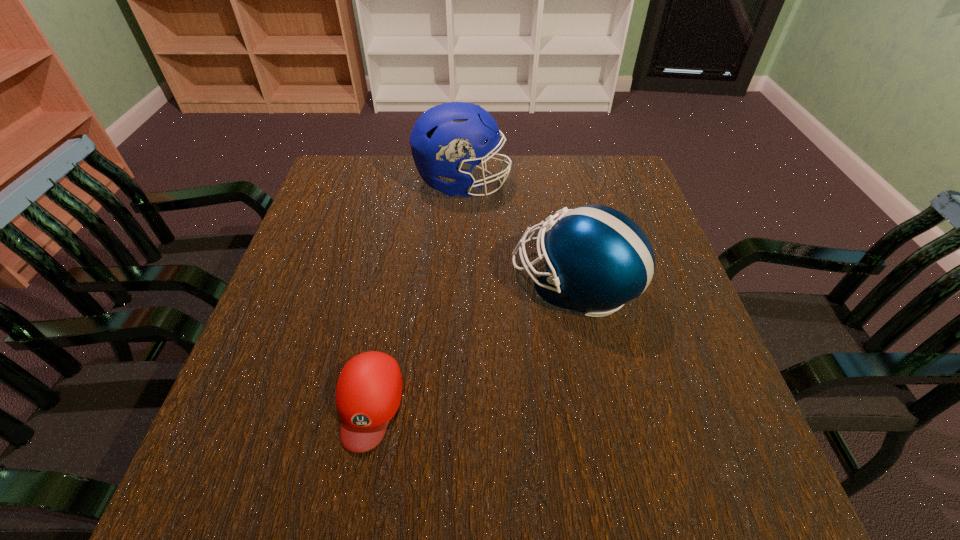
You are a GUI agent. You are given a task and a screenshot of the screen. Output one action in this format:
    pyautogui.click(x=<x>, y=<y>)
    Task: Click on the vacant area that lies between the second farthest object and the farthest object
    
    Given the screenshot: What is the action you would take?
    pyautogui.click(x=518, y=235)

At what (x,y) coordinates should I click in order to perform the action: click on vacant region between the nearest object and the second farthest object. Please return your answer as a coordinate pair (x, y). This screenshot has height=540, width=960. Looking at the image, I should click on (471, 344).

At what (x,y) coordinates should I click in order to perform the action: click on free spot between the baseball cap and the farther football helmet. Please return your answer as a coordinate pair (x, y). Looking at the image, I should click on 416,294.

This screenshot has height=540, width=960. Identify the location of vacant space in between the farthest object and the baseball cap. (416, 294).

You are a GUI agent. You are given a task and a screenshot of the screen. Output one action in this format:
    pyautogui.click(x=<x>, y=<y>)
    Task: Click on the free space between the nearer football helmet and the farther football helmet
    Image resolution: width=960 pixels, height=540 pixels.
    Given the screenshot: What is the action you would take?
    pyautogui.click(x=518, y=235)

Where is `object that stands as the closest to the nearer football helmet`? object that stands as the closest to the nearer football helmet is located at coordinates pyautogui.click(x=445, y=141).

This screenshot has height=540, width=960. In order to click on object that is the second closest one to the shortest object in this screenshot , I will do `click(445, 141)`.

You are a GUI agent. You are given a task and a screenshot of the screen. Output one action in this format:
    pyautogui.click(x=<x>, y=<y>)
    Task: Click on the free region that satisfies the following two spatial constraints: 1. on the front-facing side of the farther football helmet; 2. on the front-facing side of the shortest object
    The width and height of the screenshot is (960, 540).
    Given the screenshot: What is the action you would take?
    pyautogui.click(x=452, y=403)

The height and width of the screenshot is (540, 960). I want to click on free spot that satisfies the following two spatial constraints: 1. at the front of the second farthest object with the faceguard; 2. on the front-facing side of the nearest object, so click(x=597, y=403).

Image resolution: width=960 pixels, height=540 pixels. In order to click on vacant region that satisfies the following two spatial constraints: 1. on the front-facing side of the farthest object; 2. on the front-facing side of the shortest object in this screenshot , I will do `click(452, 403)`.